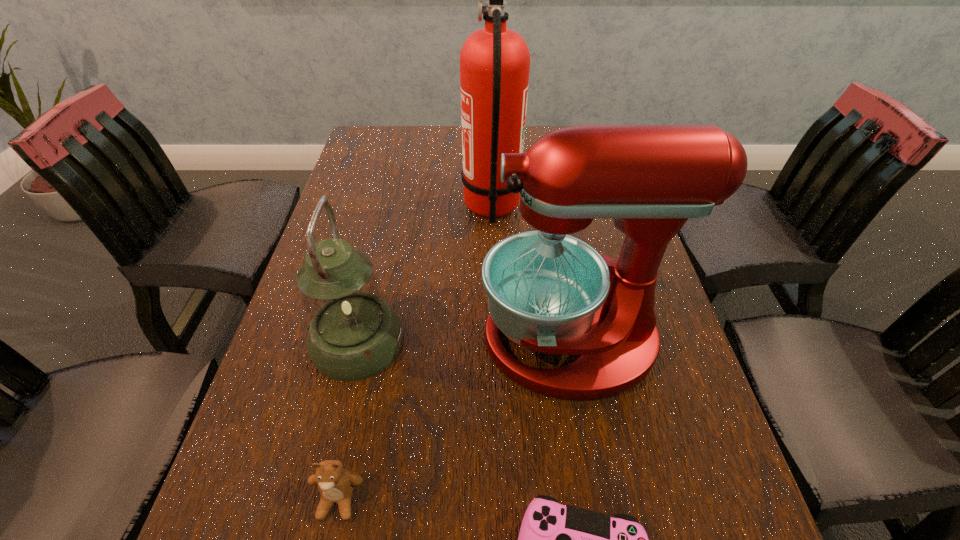
Where is `empty space between the fire extinguisher and the second shortest object`? The height and width of the screenshot is (540, 960). empty space between the fire extinguisher and the second shortest object is located at coordinates (415, 354).

What are the coordinates of `unoccupied position between the teddy bear and the tallest object` in the screenshot? It's located at (415, 354).

Find the location of a particular element. empty location between the lantern and the mixer is located at coordinates click(464, 341).

Where is `blank region between the lantern and the farthest object`? The image size is (960, 540). blank region between the lantern and the farthest object is located at coordinates (424, 274).

Where is `vacant region between the fourth tallest object and the mixer`? vacant region between the fourth tallest object and the mixer is located at coordinates (454, 420).

Locate an element on the screen. This screenshot has height=540, width=960. free spot between the teddy bear and the fourth shortest object is located at coordinates (454, 420).

At what (x,y) coordinates should I click in order to perform the action: click on the fourth closest object to the second shortest object. Please return your answer as a coordinate pair (x, y). Looking at the image, I should click on (494, 61).

Locate an element on the screen. object that stands as the closest to the third tallest object is located at coordinates (547, 291).

Identify the location of vacant region that satisfies the following two spatial constraints: 1. on the handle side of the tallest object; 2. on the front-facing side of the teddy bear. The height and width of the screenshot is (540, 960). (500, 500).

Where is `free space that satisfies the following two spatial constraints: 1. on the handle side of the tallest object; 2. on the front-facing side of the teddy bear`? This screenshot has width=960, height=540. free space that satisfies the following two spatial constraints: 1. on the handle side of the tallest object; 2. on the front-facing side of the teddy bear is located at coordinates click(x=500, y=500).